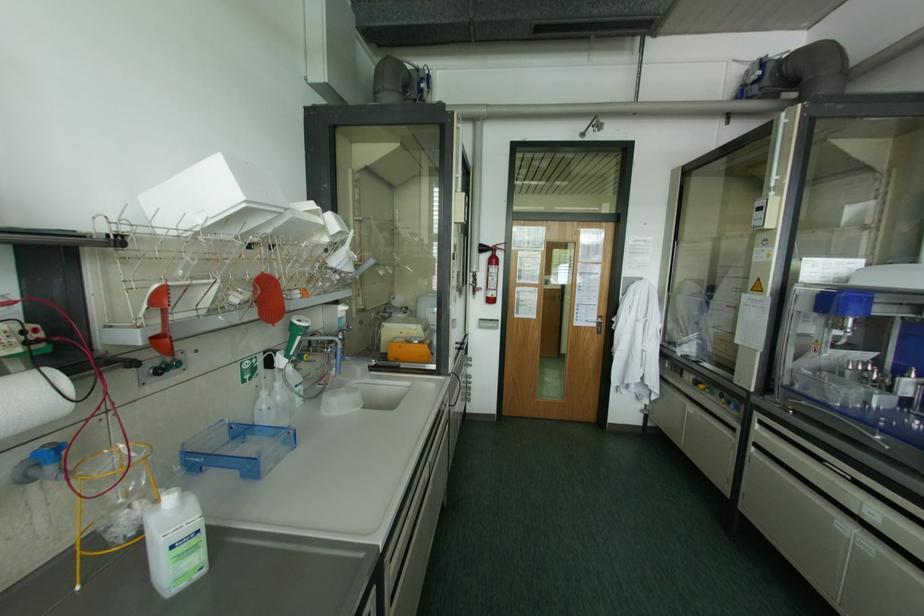
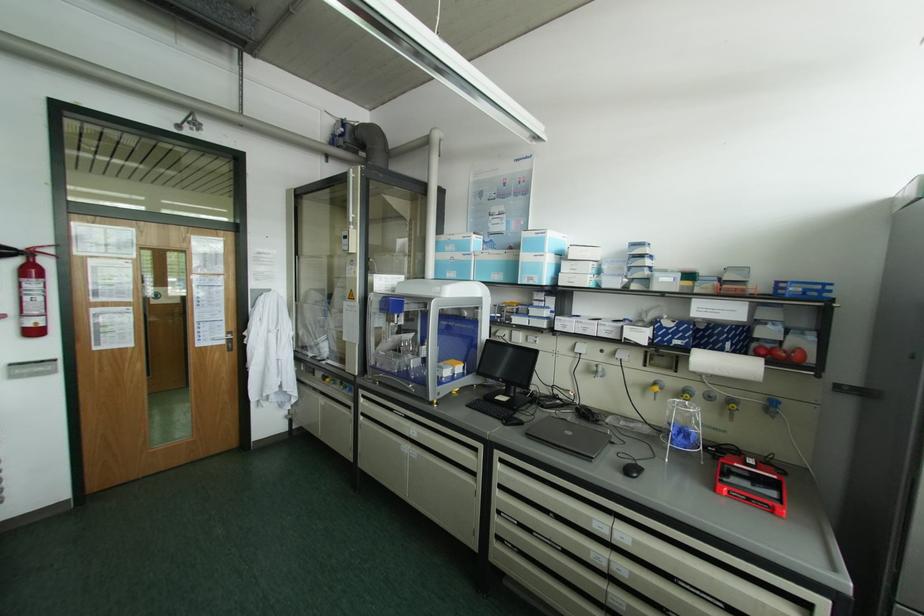
Find the pixel in the second image that matches (593,323) in the first image.

(224, 342)